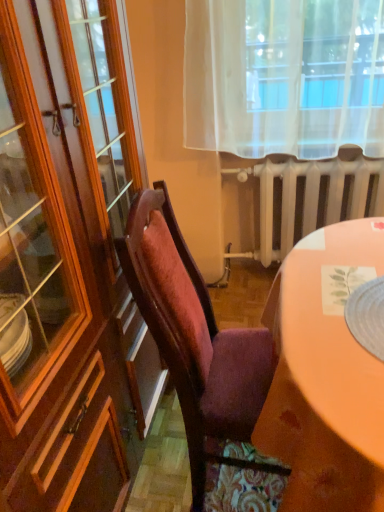
Question: Can you confirm if white metallic radiator at center is positioned to the left of wooden chair at center?

Choices:
 (A) no
 (B) yes

Answer: (A)

Question: Can you confirm if white metallic radiator at center is positioned to the right of wooden chair at center?

Choices:
 (A) yes
 (B) no

Answer: (A)

Question: From a real-world perspective, is white metallic radiator at center located beneath wooden chair at center?

Choices:
 (A) no
 (B) yes

Answer: (B)

Question: Can you confirm if white metallic radiator at center is thinner than wooden chair at center?

Choices:
 (A) yes
 (B) no

Answer: (A)

Question: Is white metallic radiator at center smaller than wooden chair at center?

Choices:
 (A) no
 (B) yes

Answer: (B)

Question: Is the depth of white metallic radiator at center less than that of wooden chair at center?

Choices:
 (A) no
 (B) yes

Answer: (A)

Question: Considering the relative positions of wooden chair at center and white metallic radiator at center in the image provided, is wooden chair at center to the right of white metallic radiator at center from the viewer's perspective?

Choices:
 (A) no
 (B) yes

Answer: (A)

Question: Could white metallic radiator at center be considered to be inside wooden chair at center?

Choices:
 (A) yes
 (B) no

Answer: (B)

Question: Does wooden chair at center lie behind white metallic radiator at center?

Choices:
 (A) no
 (B) yes

Answer: (A)

Question: Is the position of wooden chair at center less distant than that of white metallic radiator at center?

Choices:
 (A) no
 (B) yes

Answer: (B)

Question: Is wooden chair at center with white metallic radiator at center?

Choices:
 (A) yes
 (B) no

Answer: (B)

Question: Is wooden chair at center positioned with its back to white metallic radiator at center?

Choices:
 (A) no
 (B) yes

Answer: (A)

Question: Considering their positions, is wooden chair at center located in front of or behind white metallic radiator at center?

Choices:
 (A) front
 (B) behind

Answer: (A)